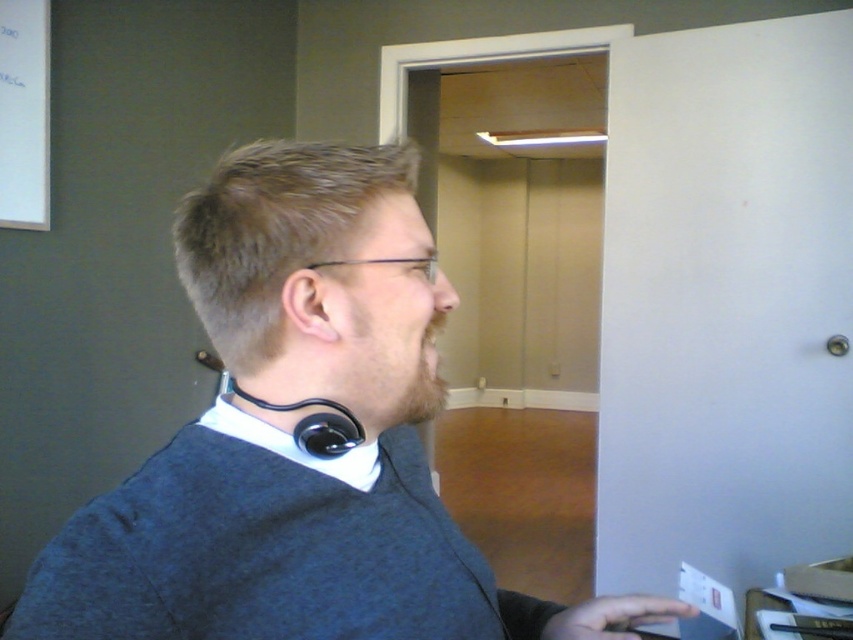
Question: Is dark gray sweater at center positioned in front of skinny black ear at center?

Choices:
 (A) no
 (B) yes

Answer: (B)

Question: Does dark gray sweater at center lie in front of skinny black ear at center?

Choices:
 (A) yes
 (B) no

Answer: (A)

Question: Which point is closer to the camera?

Choices:
 (A) (173, 593)
 (B) (296, 296)

Answer: (A)

Question: Where is dark gray sweater at center located in relation to skinny black ear at center in the image?

Choices:
 (A) right
 (B) left

Answer: (A)

Question: Which point is farther to the camera?

Choices:
 (A) (291, 285)
 (B) (178, 598)

Answer: (A)